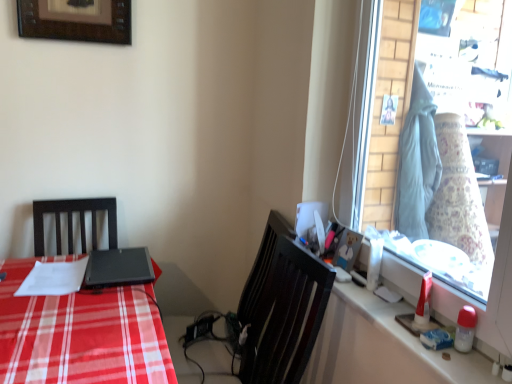
Question: In the image, is matte black desk at left on the left side or the right side of matte plastic picture frame at upper right, the 1th picture frame viewed from the front?

Choices:
 (A) left
 (B) right

Answer: (A)

Question: Do you think matte black desk at left is within matte plastic picture frame at upper right, the 2th picture frame viewed from the left, or outside of it?

Choices:
 (A) inside
 (B) outside

Answer: (B)

Question: Which object is positioned farthest from the white glossy counter top at right?

Choices:
 (A) black matte laptop at center
 (B) matte black desk at left
 (C) glass window at right
 (D) matte plastic picture frame at upper right, the 1th picture frame viewed from the front
 (E) wooden framed picture at upper left, arranged as the second picture frame when viewed from the right

Answer: (E)

Question: Based on their relative distances, which object is nearer to the white glossy counter top at right?

Choices:
 (A) glass window at right
 (B) black matte laptop at center
 (C) matte black desk at left
 (D) wooden framed picture at upper left, the 1th picture frame viewed from the back
 (E) matte plastic picture frame at upper right, the 2th picture frame in the top-to-bottom sequence

Answer: (E)